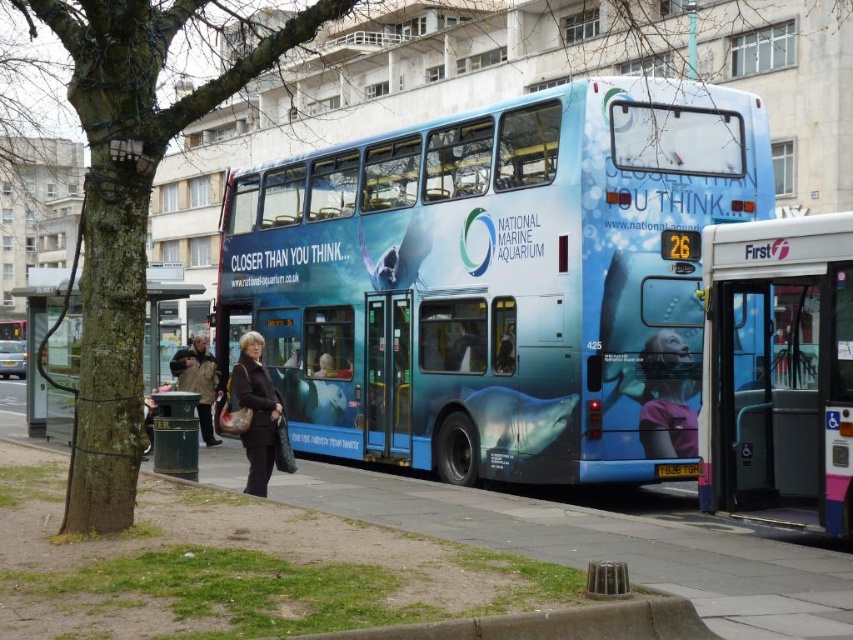
Question: Is blue glossy bus at center below green plastic trash can at left?

Choices:
 (A) yes
 (B) no

Answer: (B)

Question: Which object appears closest to the camera in this image?

Choices:
 (A) brown leather jacket at center
 (B) blue metallic bus at center
 (C) green plastic trash can at left
 (D) black plastic license plate at center

Answer: (C)

Question: Estimate the real-world distances between objects in this image. Which object is closer to the blue glossy bus at center?

Choices:
 (A) green plastic trash can at left
 (B) blue metallic bus at center
 (C) brown leather jacket at center

Answer: (C)

Question: Can you confirm if brown leather jacket at center is positioned to the right of black plastic license plate at center?

Choices:
 (A) no
 (B) yes

Answer: (A)

Question: Is blue metallic bus at center above green plastic trash can at left?

Choices:
 (A) yes
 (B) no

Answer: (B)

Question: Which point is closer to the camera taking this photo?

Choices:
 (A) (817, 289)
 (B) (207, 403)

Answer: (A)